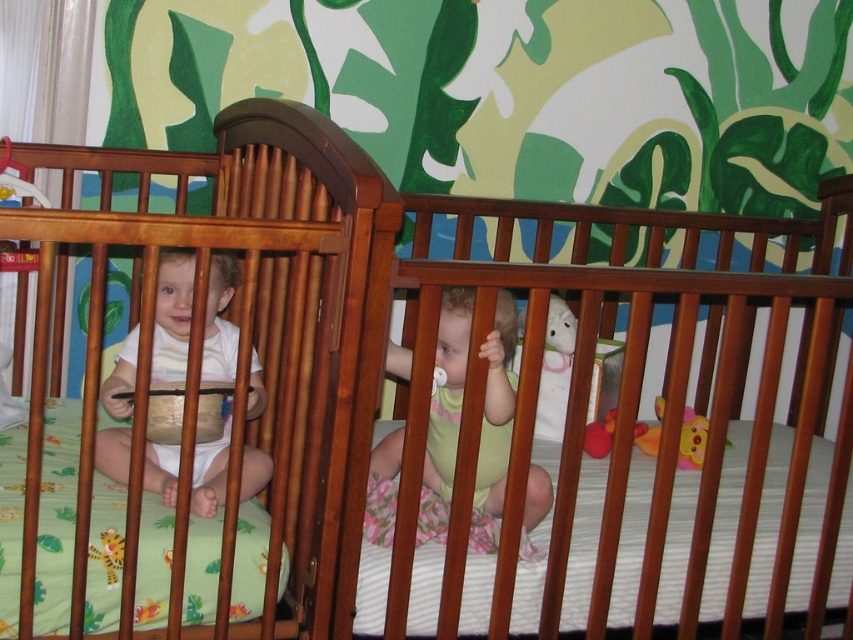
Based on the coordinates provided, where is the white matte baby at left positioned in the image?

The white matte baby at left is positioned at the coordinates point [172,314].

You are standing in the nursery and want to reach the point marked at coordinates (466, 356). If your arm can extend 1.2 meters, can you touch that point without moving your feet?

The distance between you and the point marked at coordinates (466, 356) is 1.46 meters. Since your arm can only extend 1.2 meters, you cannot touch the point without moving your feet.